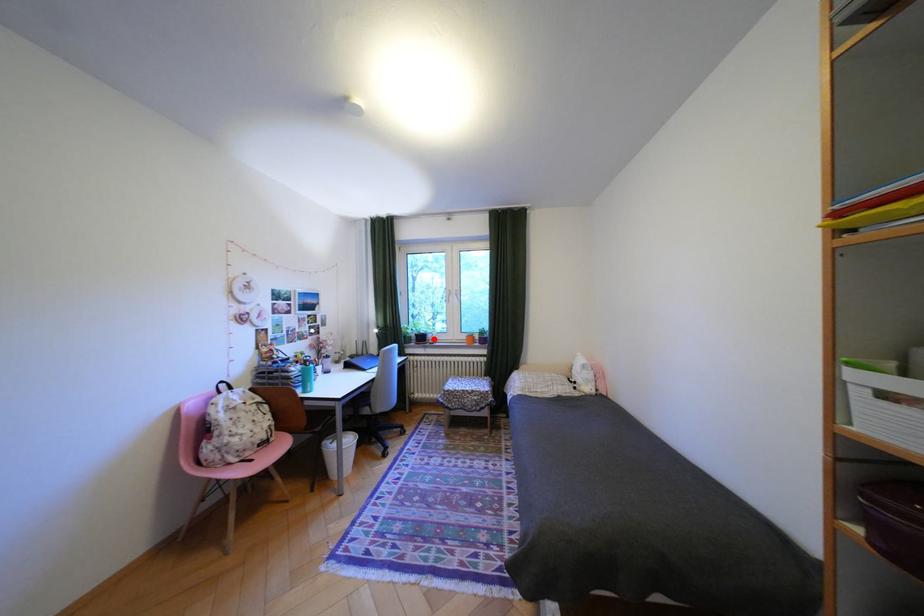
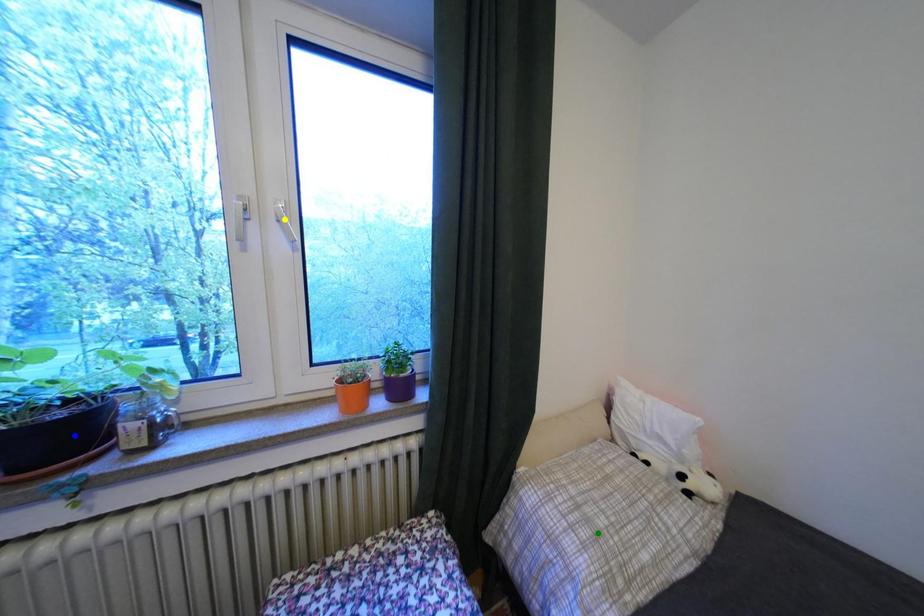
Question: I am providing you with two images of the same scene from different viewpoints. A red point is marked on the first image. You are given multiple points on the second image. Which mark in image 2 goes with the point in image 1?

Choices:
 (A) green point
 (B) yellow point
 (C) blue point

Answer: (C)